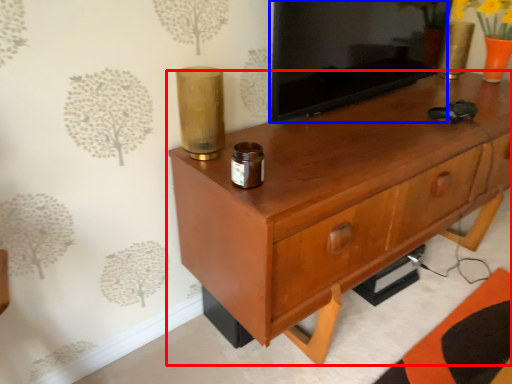
Question: Which object is further to the camera taking this photo, chest of drawers (highlighted by a red box) or tv cabinet (highlighted by a blue box)?

Choices:
 (A) chest of drawers
 (B) tv cabinet

Answer: (B)